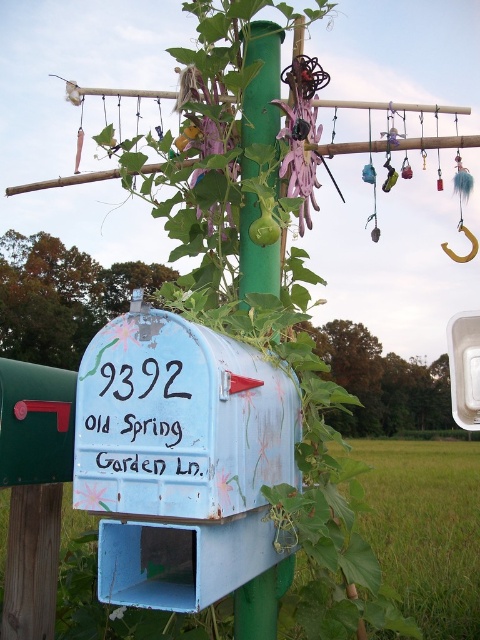
You are standing in front of the mailbox and need to locate the green matte pole at center. Can you tell me its exact 2D coordinates?

The green matte pole at center is located at the 2D coordinates of point [262,84].

You are a gardener who wants to place a new flower pot between the purple fabric flower at center and the white matte flower at center. If the pot is 100 centimeters wide, will it fit in the space between them?

The purple fabric flower at center and white matte flower at center are 98.05 centimeters apart. Since the pot is 100 centimeters wide, it is slightly wider than the available space, so it won

You are standing in front of the mailbox and want to take a photo. There are two points marked on the mailbox at coordinates point (266,61) and point (304,193). Which point will appear larger in your photo?

Point (266,61) will appear larger in the photo because it is closer to the camera than point (304,193).